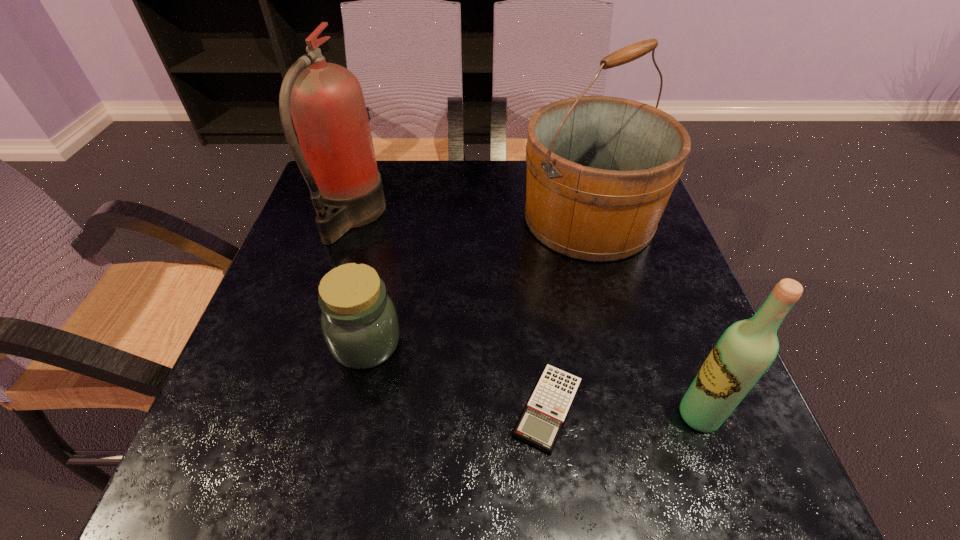
Find the location of a particular element. Image resolution: width=960 pixels, height=540 pixels. object that is at the far right corner is located at coordinates (600, 170).

You are a GUI agent. You are given a task and a screenshot of the screen. Output one action in this format:
    pyautogui.click(x=<x>, y=<y>)
    Task: Click on the vacant space at the far edge
    
    Given the screenshot: What is the action you would take?
    pyautogui.click(x=431, y=173)

What are the coordinates of `vacant space at the near edge of the desktop` in the screenshot? It's located at coord(646,466).

Where is `free location at the right edge`? This screenshot has width=960, height=540. free location at the right edge is located at coordinates (631, 338).

Image resolution: width=960 pixels, height=540 pixels. In order to click on free point between the wine bottle and the fire extinguisher in this screenshot , I will do `click(525, 316)`.

Locate an element on the screen. free point between the second shortest object and the shortest object is located at coordinates (457, 376).

You are a GUI agent. You are given a task and a screenshot of the screen. Output one action in this format:
    pyautogui.click(x=<x>, y=<y>)
    Task: Click on the vacant region between the bucket and the shortest object
    The height and width of the screenshot is (540, 960).
    Given the screenshot: What is the action you would take?
    pyautogui.click(x=568, y=314)

Identify the location of free spot between the second shortest object and the shortest object. This screenshot has width=960, height=540. tap(457, 376).

The height and width of the screenshot is (540, 960). Identify the location of vacant area that lies between the third shortest object and the fire extinguisher. (525, 316).

The image size is (960, 540). What are the coordinates of `free space between the shortest object and the third shortest object` in the screenshot? It's located at (624, 411).